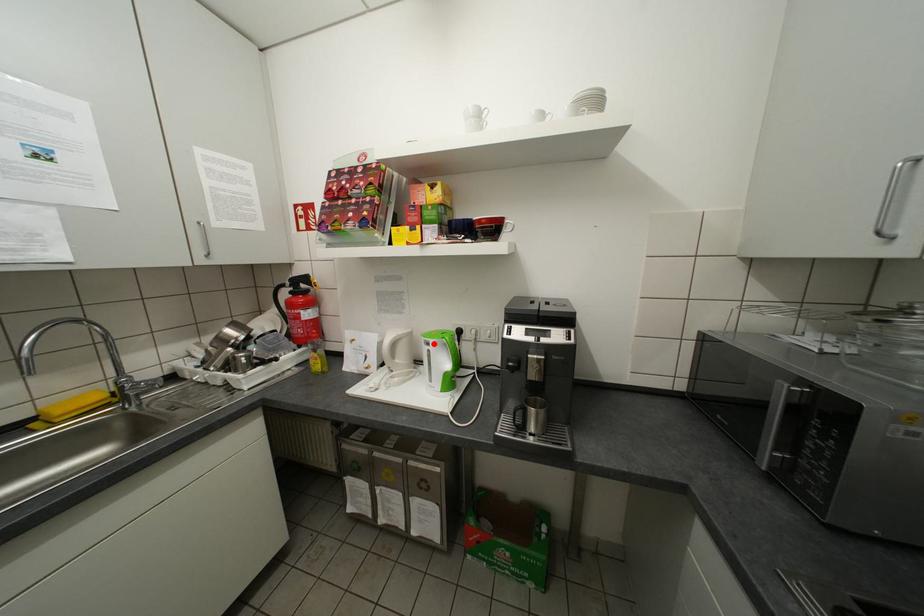
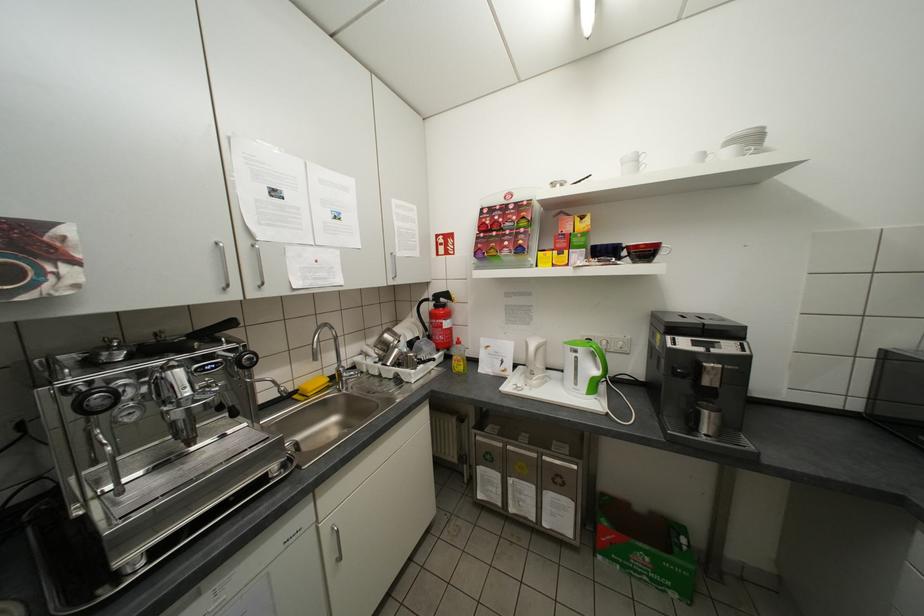
Where in the second image is the point corresponding to the highlighted location from the first image?

(579, 351)